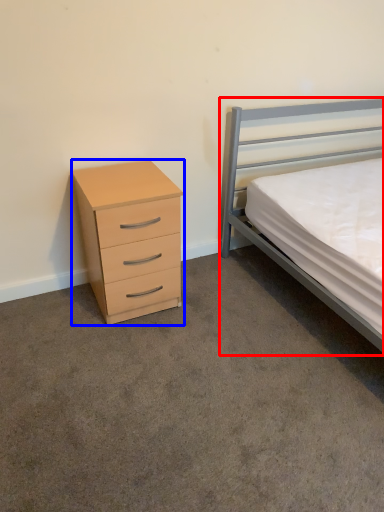
Question: Which object is closer to the camera taking this photo, bed (highlighted by a red box) or chest of drawers (highlighted by a blue box)?

Choices:
 (A) bed
 (B) chest of drawers

Answer: (A)